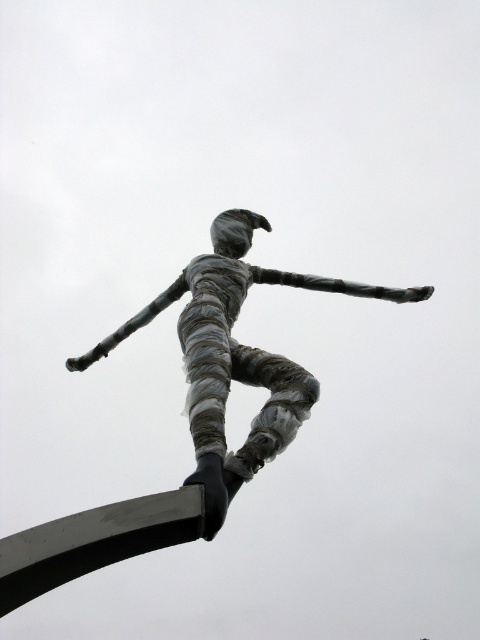
You are an art student analyzing the sculpture. From your perspective, which object is closer to you between the shiny silver figure at center and the black metal pole at lower left?

The shiny silver figure at center is closer to you than the black metal pole at lower left because it is further to the viewer.

You are a photographer trying to capture the sculpture in a way that highlights its dynamic pose. You want to position yourself so that the shiny silver figure at center and the black metal pole at lower left are both visible in the frame. Based on their positions, which side of the sculpture should you stand to ensure both elements are in view?

You should stand to the left side of the sculpture. Since the shiny silver figure at center is to the right of the black metal pole at lower left, positioning yourself to the left will allow you to see both the shiny silver figure at center and the black metal pole at lower left in the frame.